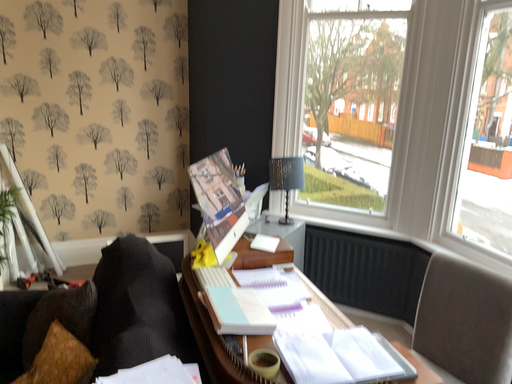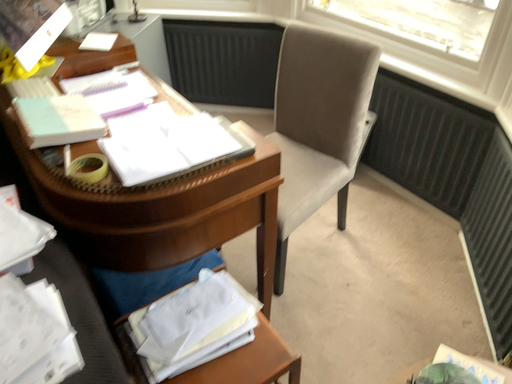
Question: How did the camera likely rotate when shooting the video?

Choices:
 (A) rotated right
 (B) rotated left

Answer: (A)